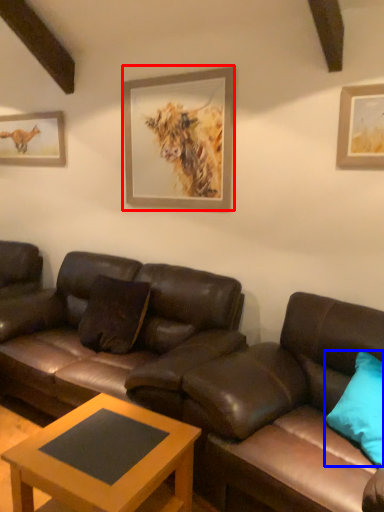
Question: Which object appears farthest to the camera in this image, picture frame (highlighted by a red box) or pillow (highlighted by a blue box)?

Choices:
 (A) picture frame
 (B) pillow

Answer: (A)